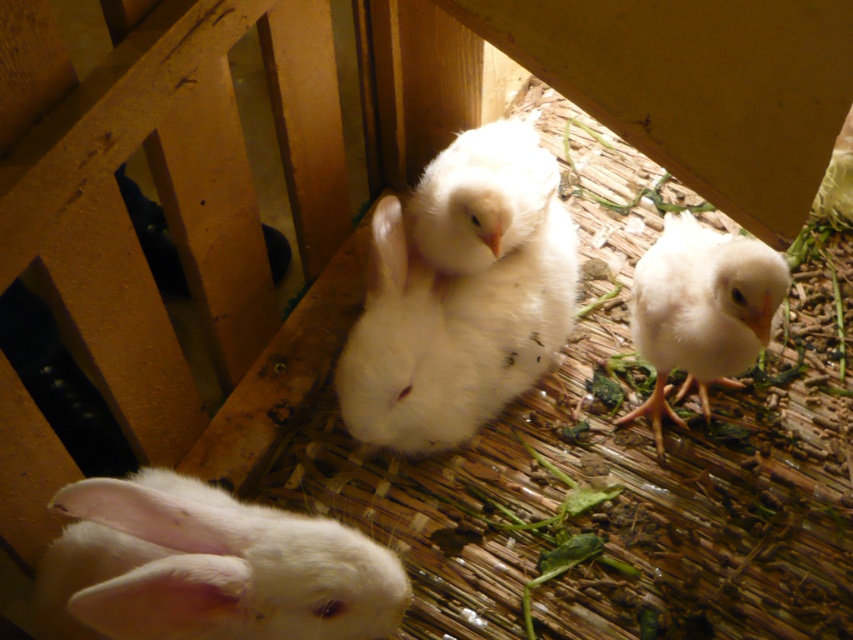
Question: Which point is farther from the camera taking this photo?

Choices:
 (A) (430, 177)
 (B) (708, 358)

Answer: (A)

Question: Is white fluffy rabbit at center in front of white fluffy rabbit at lower left?

Choices:
 (A) no
 (B) yes

Answer: (A)

Question: Which point is farther to the camera?

Choices:
 (A) white fluffy rabbit at center
 (B) white fluffy rabbit at lower right
 (C) white fluffy rabbit at lower left

Answer: (A)

Question: In this image, where is white fluffy rabbit at lower left located relative to white fluffy rabbit at lower right?

Choices:
 (A) below
 (B) above

Answer: (A)

Question: Among these objects, which one is nearest to the camera?

Choices:
 (A) white fluffy rabbit at lower right
 (B) white fluffy rabbit at center

Answer: (A)

Question: Does white fluffy rabbit at center have a lesser width compared to white fluffy rabbit at lower left?

Choices:
 (A) no
 (B) yes

Answer: (B)